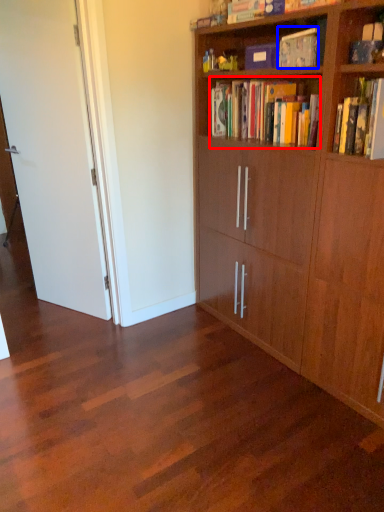
Question: Among these objects, which one is farthest to the camera, book (highlighted by a red box) or book (highlighted by a blue box)?

Choices:
 (A) book
 (B) book

Answer: (A)